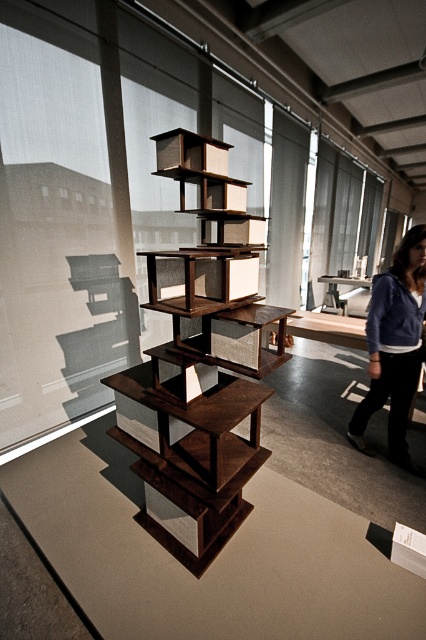
Question: Which point is closer to the camera?

Choices:
 (A) blue fleece jacket at lower right
 (B) dark brown wood bookshelf at center

Answer: (B)

Question: Observing the image, what is the correct spatial positioning of dark brown wood bookshelf at center in reference to blue fleece jacket at lower right?

Choices:
 (A) below
 (B) above

Answer: (B)

Question: Can you confirm if dark brown wood bookshelf at center is positioned below blue fleece jacket at lower right?

Choices:
 (A) yes
 (B) no

Answer: (B)

Question: Which point is closer to the camera?

Choices:
 (A) blue fleece jacket at lower right
 (B) dark brown wood bookshelf at center

Answer: (B)

Question: Which of the following is the farthest from the observer?

Choices:
 (A) blue fleece jacket at lower right
 (B) dark brown wood bookshelf at center

Answer: (A)

Question: Does dark brown wood bookshelf at center have a smaller size compared to blue fleece jacket at lower right?

Choices:
 (A) yes
 (B) no

Answer: (B)